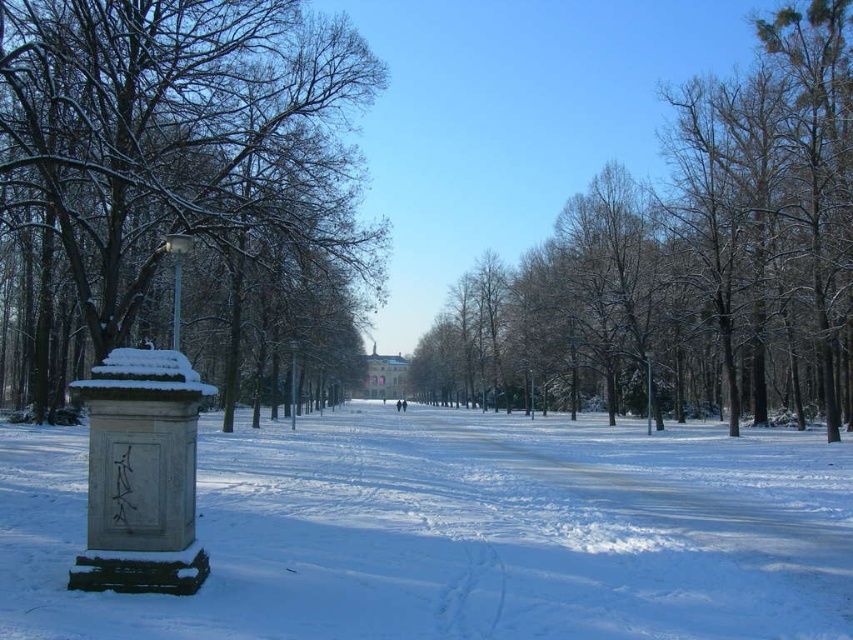
Who is more distant from viewer, (117, 620) or (726, 388)?

Point (726, 388)

Which is in front, point (758, 433) or point (670, 205)?

Point (758, 433)

The width and height of the screenshot is (853, 640). Find the location of `white powdery snow at center`. white powdery snow at center is located at coordinates (457, 532).

Where is `white powdery snow at center`? white powdery snow at center is located at coordinates (457, 532).

Who is more forward, (265, 579) or (36, 52)?

Point (265, 579) is in front.

Is point (634, 595) positioned behind point (184, 164)?

No.

This screenshot has width=853, height=640. I want to click on white powdery snow at center, so click(457, 532).

What do you see at coordinates (691, 253) in the screenshot? This screenshot has width=853, height=640. I see `snow-covered trees at center` at bounding box center [691, 253].

Can you confirm if snow-covered trees at center is positioned above snow-covered tree at left?

No, snow-covered trees at center is not above snow-covered tree at left.

Image resolution: width=853 pixels, height=640 pixels. I want to click on snow-covered trees at center, so click(691, 253).

Identify the location of snow-covered trees at center. The image size is (853, 640). tap(691, 253).